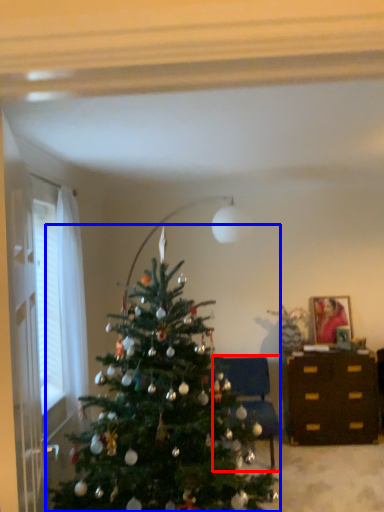
Question: Which point is further to the camera, furniture (highlighted by a red box) or christmas tree (highlighted by a blue box)?

Choices:
 (A) furniture
 (B) christmas tree

Answer: (A)